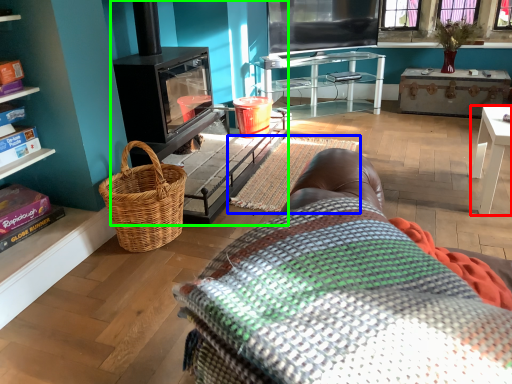
Question: Considering the real-world distances, which object is farthest from table (highlighted by a red box)? blanket (highlighted by a blue box) or fireplace (highlighted by a green box)?

Choices:
 (A) blanket
 (B) fireplace

Answer: (B)